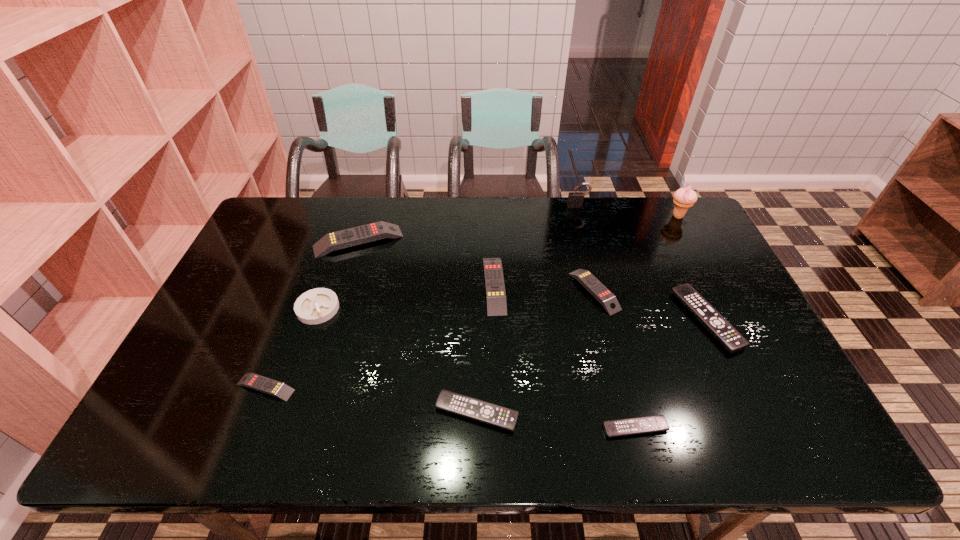
The height and width of the screenshot is (540, 960). What are the coordinates of `free spot located on the right of the second yellow remote control from right to left` in the screenshot? It's located at (592, 285).

At what (x,y) coordinates should I click in order to perform the action: click on vacant area located on the front of the rightmost yellow remote control. Please return your answer as a coordinate pair (x, y). The image size is (960, 540). Looking at the image, I should click on (613, 367).

Where is `vacant region located 0.160m on the front of the farthest black remote control`? The width and height of the screenshot is (960, 540). vacant region located 0.160m on the front of the farthest black remote control is located at coordinates (750, 412).

Find the location of a particular element. vacant space located 0.110m on the front of the smallest yellow remote control is located at coordinates (243, 447).

Find the location of a particular element. free space located 0.190m on the left of the second smallest black remote control is located at coordinates (353, 413).

Locate an element on the screen. blank area located 0.140m on the left of the smallest black remote control is located at coordinates (541, 428).

The height and width of the screenshot is (540, 960). In order to click on icecream that is at the far edge in this screenshot , I will do `click(684, 198)`.

This screenshot has height=540, width=960. What are the coordinates of `padlock that is at the far edge` in the screenshot? It's located at (574, 198).

Find the location of a particular element. The height and width of the screenshot is (540, 960). remote control at the far edge is located at coordinates (354, 236).

Identify the location of object at the left edge. This screenshot has width=960, height=540. (257, 382).